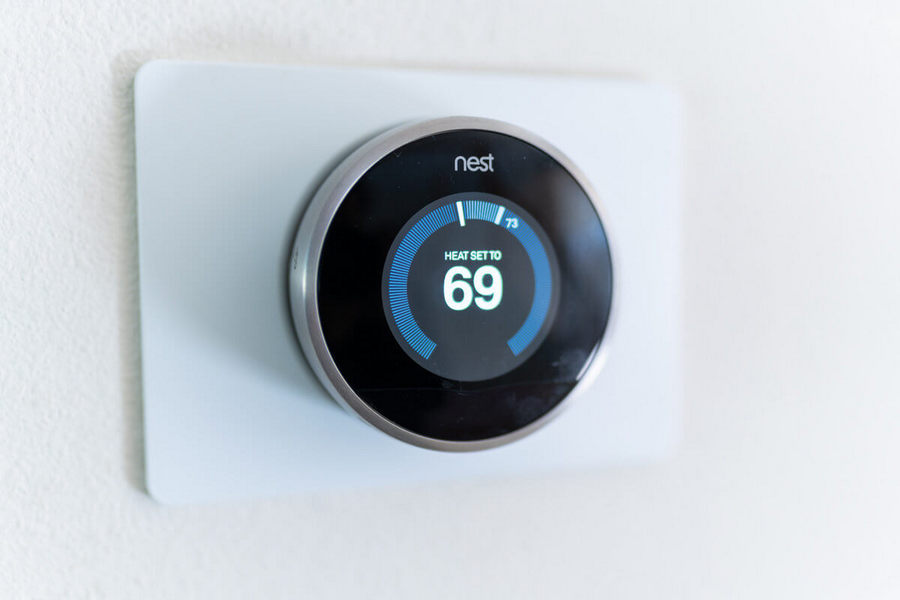
You are a GUI agent. You are given a task and a screenshot of the screen. Output one action in this format:
    pyautogui.click(x=<x>, y=<y>)
    Task: Click on the random white line on thermostat
    
    Given the screenshot: What is the action you would take?
    pyautogui.click(x=411, y=389)